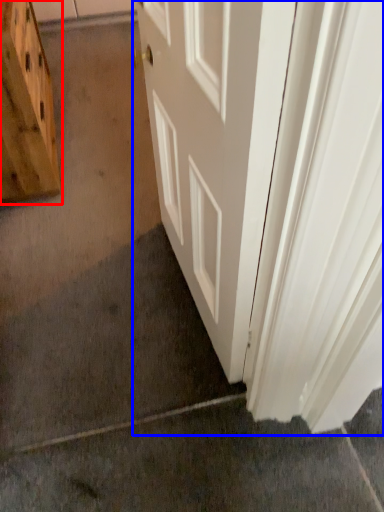
Question: Which point is closer to the camera, cabinetry (highlighted by a red box) or door (highlighted by a blue box)?

Choices:
 (A) cabinetry
 (B) door

Answer: (B)